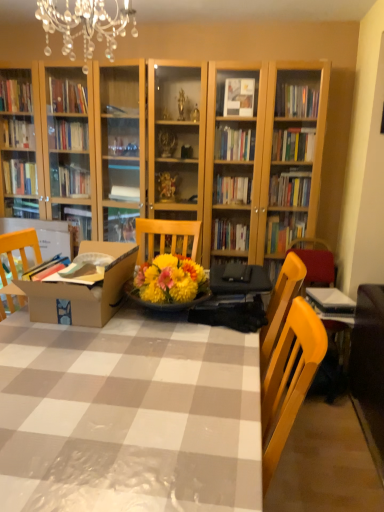
Question: In the image, is yellow wood chair at right positioned in front of or behind crystal chandelier at upper center?

Choices:
 (A) behind
 (B) front

Answer: (A)

Question: In the image, is yellow wood chair at right on the left side or the right side of crystal chandelier at upper center?

Choices:
 (A) right
 (B) left

Answer: (A)

Question: Which object is the farthest from the yellow wood chair at right?

Choices:
 (A) wooden table at center
 (B) brown cardboard box at center
 (C) crystal chandelier at upper center

Answer: (C)

Question: Based on their relative distances, which object is farther from the crystal chandelier at upper center?

Choices:
 (A) brown cardboard box at center
 (B) wooden table at center
 (C) yellow wood chair at right

Answer: (C)